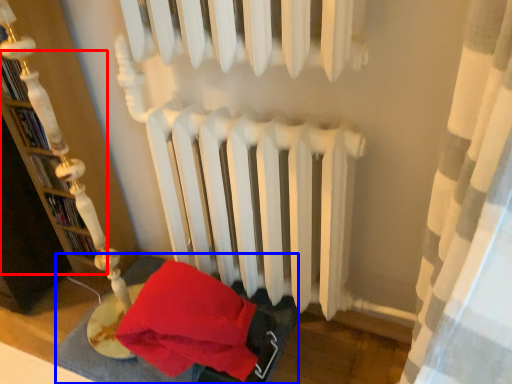
Question: Among these objects, which one is farthest to the camera, bookshelf (highlighted by a red box) or bed frame (highlighted by a blue box)?

Choices:
 (A) bookshelf
 (B) bed frame

Answer: (B)